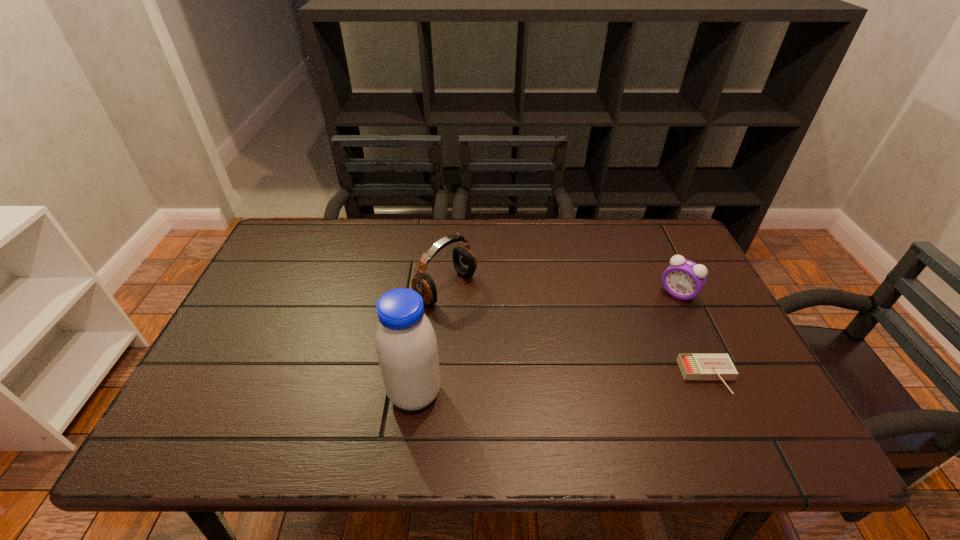
The width and height of the screenshot is (960, 540). In the image, there is a desktop. Identify the location of vacant space at the near right corner. (713, 400).

This screenshot has height=540, width=960. I want to click on free spot between the third shortest object and the second shortest object, so click(x=562, y=291).

You are a GUI agent. You are given a task and a screenshot of the screen. Output one action in this format:
    pyautogui.click(x=<x>, y=<y>)
    Task: Click on the vacant area that lies between the soya milk and the second shortest object
    
    Given the screenshot: What is the action you would take?
    pyautogui.click(x=546, y=343)

I want to click on free spot between the second shortest object and the soya milk, so click(546, 343).

At what (x,y) coordinates should I click in order to perform the action: click on vacant point located between the matchbox and the alarm clock. Please return your answer as a coordinate pair (x, y). This screenshot has height=540, width=960. Looking at the image, I should click on (693, 335).

I want to click on empty space that is in between the alarm clock and the shortest object, so click(693, 335).

Image resolution: width=960 pixels, height=540 pixels. In order to click on vacant point located between the second shortest object and the soya milk in this screenshot , I will do `click(546, 343)`.

Find the location of `empty location between the third shortest object and the alarm clock`. empty location between the third shortest object and the alarm clock is located at coordinates (562, 291).

You are a GUI agent. You are given a task and a screenshot of the screen. Output one action in this format:
    pyautogui.click(x=<x>, y=<y>)
    Task: Click on the vacant area that lies between the shortest object and the headset
    
    Given the screenshot: What is the action you would take?
    pyautogui.click(x=577, y=332)

Find the location of `unoccupied position between the shortest object and the third shortest object`. unoccupied position between the shortest object and the third shortest object is located at coordinates (577, 332).